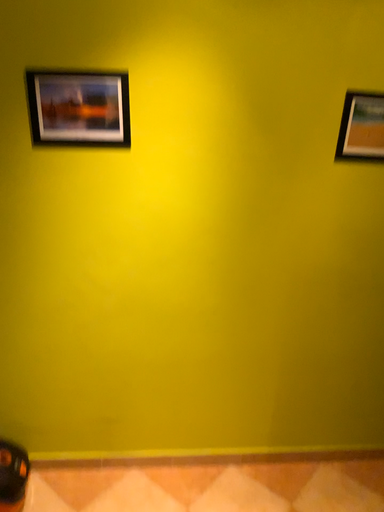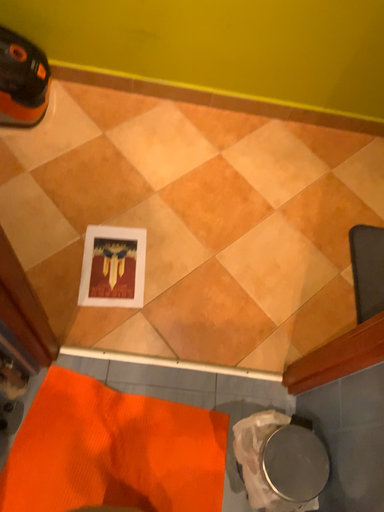
Question: How did the camera likely rotate when shooting the video?

Choices:
 (A) rotated upward
 (B) rotated downward

Answer: (B)